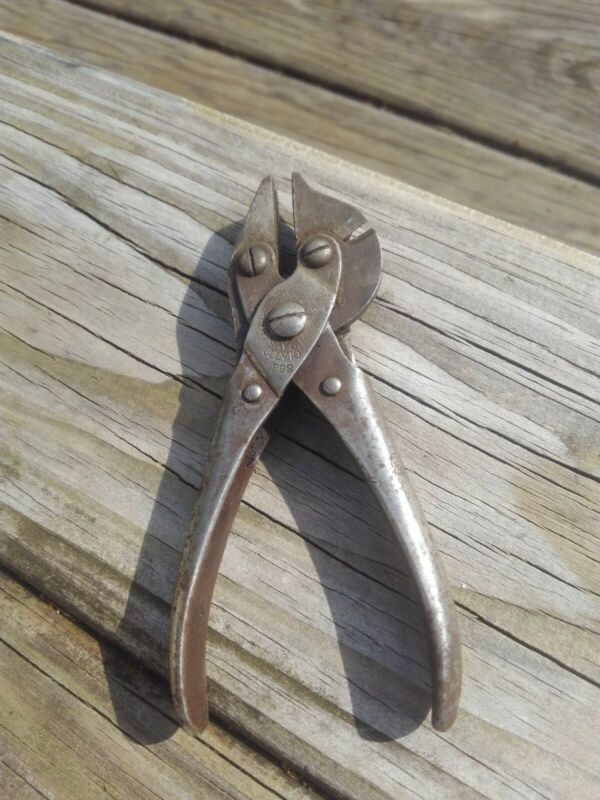
Locate an element on the screen. metal handle is located at coordinates (420, 560).